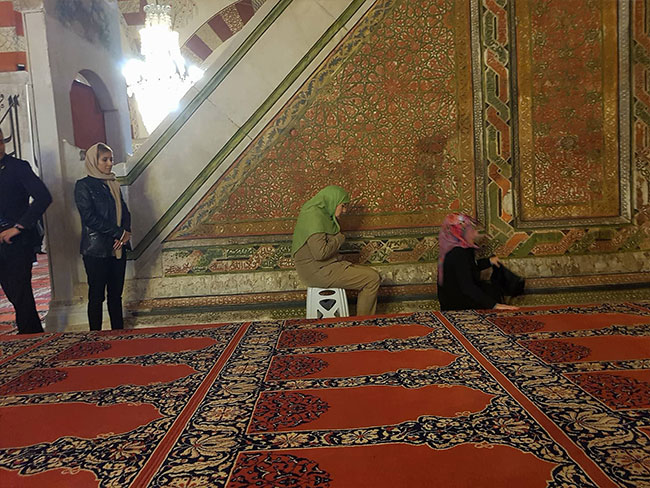
Identify the location of ornate pattern. The image size is (650, 488). (407, 142).